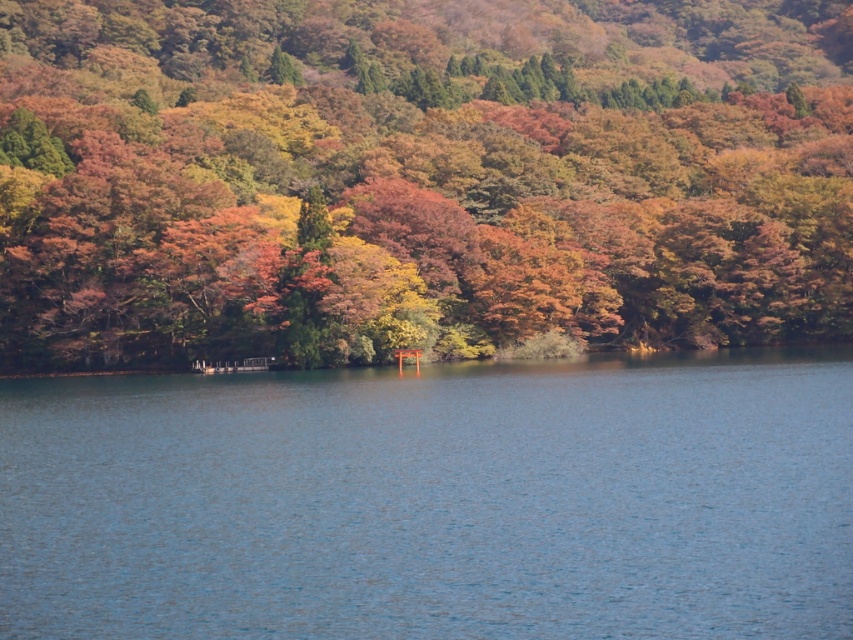
Where are the autumn leaves at center located in the image?

The autumn leaves at center are located at point (x=418, y=176) in the image.

Based on the photo, you are planning to place a 300 feet long boat between the autumn leaves at center and the blue water at center. Will the boat fit between them without overlapping?

The distance between the autumn leaves at center and the blue water at center is 317.47 feet. Since the boat is 300 feet long, it will fit between them without overlapping.